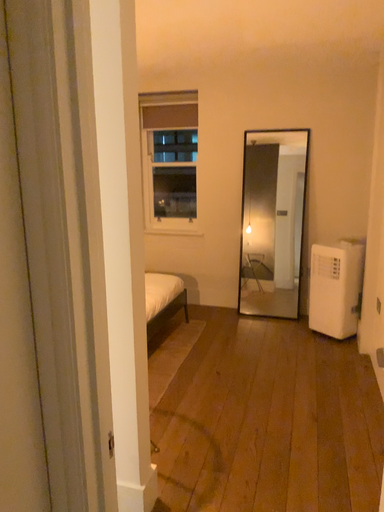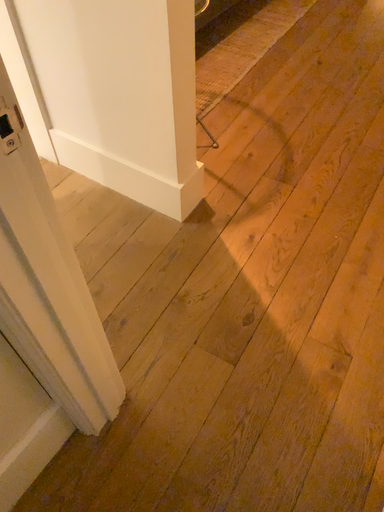
Question: Which way did the camera rotate in the video?

Choices:
 (A) rotated left
 (B) rotated right

Answer: (A)